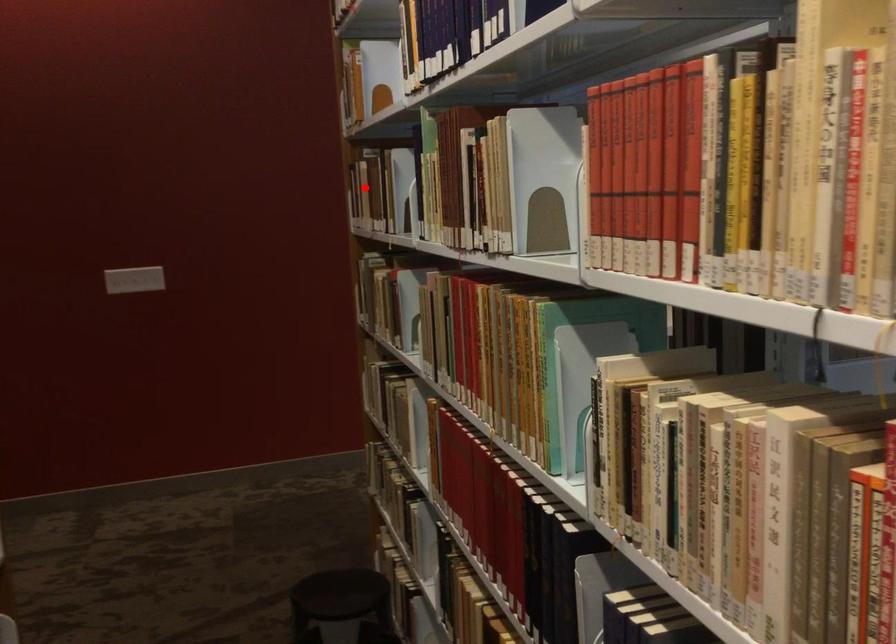
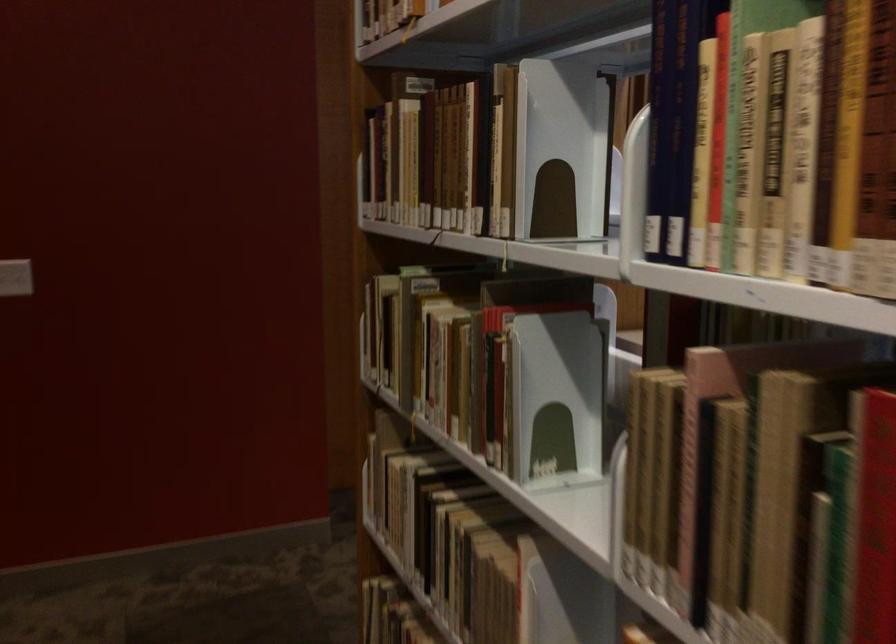
The point at the highlighted location is marked in the first image. Where is the corresponding point in the second image?

(425, 158)